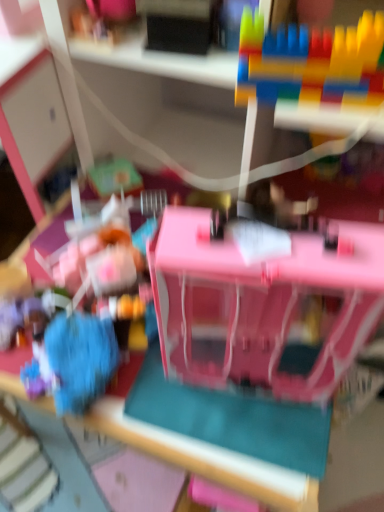
This screenshot has width=384, height=512. What do you see at coordinates (261, 301) in the screenshot?
I see `pink plastic dollhouse at center, arranged as the second toy when viewed from the left` at bounding box center [261, 301].

What is the approximate width of blue fuzzy ball at lower left, which is the first toy in bottom-to-top order?

It is 13.19 centimeters.

What do you see at coordinates (80, 359) in the screenshot? The image size is (384, 512). I see `blue fuzzy ball at lower left, the 3th toy from the right` at bounding box center [80, 359].

Image resolution: width=384 pixels, height=512 pixels. What are the coordinates of `multicolored plastic blocks at upper right, acting as the 1th toy starting from the top` in the screenshot? It's located at (311, 62).

Where is `pink plastic dollhouse at center, the second toy viewed from the right`? The image size is (384, 512). pink plastic dollhouse at center, the second toy viewed from the right is located at coordinates (261, 301).

From a real-world perspective, is multicolored plastic blocks at upper right, placed as the third toy when sorted from left to right, positioned above or below pink plastic dollhouse at center, arranged as the second toy when viewed from the left?

From a real-world perspective, multicolored plastic blocks at upper right, placed as the third toy when sorted from left to right, is physically above pink plastic dollhouse at center, arranged as the second toy when viewed from the left.

Can you confirm if multicolored plastic blocks at upper right, placed as the 1th toy when sorted from right to left, is bigger than pink plastic dollhouse at center, the second toy viewed from the right?

Actually, multicolored plastic blocks at upper right, placed as the 1th toy when sorted from right to left, might be smaller than pink plastic dollhouse at center, the second toy viewed from the right.

Find the location of a particular element. The image size is (384, 512). toy that is the 1st one below the multicolored plastic blocks at upper right, placed as the third toy when sorted from left to right (from a real-world perspective) is located at coordinates (261, 301).

Would you consider blue fuzzy ball at lower left, the 3th toy when ordered from top to bottom, to be distant from multicolored plastic blocks at upper right, acting as the 1th toy starting from the top?

No, blue fuzzy ball at lower left, the 3th toy when ordered from top to bottom, is not far away from multicolored plastic blocks at upper right, acting as the 1th toy starting from the top.

Considering their positions, is blue fuzzy ball at lower left, which is the first toy in bottom-to-top order, located in front of or behind multicolored plastic blocks at upper right, which is counted as the 3th toy, starting from the bottom?

In the image, blue fuzzy ball at lower left, which is the first toy in bottom-to-top order, appears behind multicolored plastic blocks at upper right, which is counted as the 3th toy, starting from the bottom.

Consider the image. From the image's perspective, between blue fuzzy ball at lower left, which is the 1th toy from left to right, and multicolored plastic blocks at upper right, acting as the 1th toy starting from the top, which one is located above?

multicolored plastic blocks at upper right, acting as the 1th toy starting from the top, is shown above in the image.

How much distance is there between multicolored plastic blocks at upper right, placed as the third toy when sorted from left to right, and blue fuzzy ball at lower left, which is the first toy in bottom-to-top order?

They are 18.88 inches apart.

Between multicolored plastic blocks at upper right, which is counted as the 3th toy, starting from the bottom, and blue fuzzy ball at lower left, the 3th toy when ordered from top to bottom, which one appears on the right side from the viewer's perspective?

From the viewer's perspective, multicolored plastic blocks at upper right, which is counted as the 3th toy, starting from the bottom, appears more on the right side.

Considering the positions of point (312, 81) and point (61, 340), is point (312, 81) closer or farther from the camera than point (61, 340)?

Point (312, 81) is closer to the camera than point (61, 340).

Locate an element on the screen. The width and height of the screenshot is (384, 512). toy lying behind the multicolored plastic blocks at upper right, placed as the 1th toy when sorted from right to left is located at coordinates (80, 359).

Is point (98, 372) in front of point (233, 254)?

No, (98, 372) is further to viewer.

From the image's perspective, which one is positioned lower, blue fuzzy ball at lower left, which is the first toy in bottom-to-top order, or pink plastic dollhouse at center, the second toy in the bottom-to-top sequence?

blue fuzzy ball at lower left, which is the first toy in bottom-to-top order, from the image's perspective.

Is blue fuzzy ball at lower left, which is the first toy in bottom-to-top order, facing towards pink plastic dollhouse at center, the second toy in the bottom-to-top sequence?

No, blue fuzzy ball at lower left, which is the first toy in bottom-to-top order, is not facing towards pink plastic dollhouse at center, the second toy in the bottom-to-top sequence.

Does blue fuzzy ball at lower left, the 3th toy when ordered from top to bottom, have a greater height compared to pink plastic dollhouse at center, the second toy in the bottom-to-top sequence?

No, blue fuzzy ball at lower left, the 3th toy when ordered from top to bottom, is not taller than pink plastic dollhouse at center, the second toy in the bottom-to-top sequence.

Does pink plastic dollhouse at center, the second toy in the bottom-to-top sequence, appear on the left side of blue fuzzy ball at lower left, the 3th toy when ordered from top to bottom?

No.

Can you tell me how much pink plastic dollhouse at center, the second toy in the bottom-to-top sequence, and blue fuzzy ball at lower left, which is the 1th toy from left to right, differ in facing direction?

The angle between the facing direction of pink plastic dollhouse at center, the second toy in the bottom-to-top sequence, and the facing direction of blue fuzzy ball at lower left, which is the 1th toy from left to right, is 15.1 degrees.

Which is correct: pink plastic dollhouse at center, arranged as the second toy when viewed from the left, is inside blue fuzzy ball at lower left, the 3th toy from the right, or outside of it?

pink plastic dollhouse at center, arranged as the second toy when viewed from the left, lies outside blue fuzzy ball at lower left, the 3th toy from the right.

Would you consider pink plastic dollhouse at center, the 2th toy when ordered from top to bottom, to be distant from blue fuzzy ball at lower left, which is the 1th toy from left to right?

No, pink plastic dollhouse at center, the 2th toy when ordered from top to bottom, is not far away from blue fuzzy ball at lower left, which is the 1th toy from left to right.

From a real-world perspective, which is physically below, pink plastic dollhouse at center, arranged as the second toy when viewed from the left, or multicolored plastic blocks at upper right, placed as the third toy when sorted from left to right?

pink plastic dollhouse at center, arranged as the second toy when viewed from the left.

Considering the sizes of pink plastic dollhouse at center, the 2th toy when ordered from top to bottom, and multicolored plastic blocks at upper right, placed as the 1th toy when sorted from right to left, in the image, is pink plastic dollhouse at center, the 2th toy when ordered from top to bottom, taller or shorter than multicolored plastic blocks at upper right, placed as the 1th toy when sorted from right to left,?

Considering their sizes, pink plastic dollhouse at center, the 2th toy when ordered from top to bottom, has more height than multicolored plastic blocks at upper right, placed as the 1th toy when sorted from right to left.

Could you tell me if pink plastic dollhouse at center, the second toy viewed from the right, is turned towards multicolored plastic blocks at upper right, acting as the 1th toy starting from the top?

No, pink plastic dollhouse at center, the second toy viewed from the right, is not facing towards multicolored plastic blocks at upper right, acting as the 1th toy starting from the top.

Is point (177, 271) more distant than point (258, 23)?

No, it is in front of (258, 23).

Identify the location of toy located above the pink plastic dollhouse at center, the second toy viewed from the right (from the image's perspective). The height and width of the screenshot is (512, 384). (311, 62).

Find the location of a particular element. The width and height of the screenshot is (384, 512). toy that is the 2nd object above the blue fuzzy ball at lower left, which is the first toy in bottom-to-top order (from a real-world perspective) is located at coordinates (311, 62).

Consider the image. Estimate the real-world distances between objects in this image. Which object is closer to pink plastic dollhouse at center, the second toy viewed from the right, multicolored plastic blocks at upper right, placed as the 1th toy when sorted from right to left, or blue fuzzy ball at lower left, which is the 1th toy from left to right?

The object closer to pink plastic dollhouse at center, the second toy viewed from the right, is blue fuzzy ball at lower left, which is the 1th toy from left to right.

Looking at this image, from the image, which object appears to be farther from multicolored plastic blocks at upper right, placed as the 1th toy when sorted from right to left, pink plastic dollhouse at center, arranged as the second toy when viewed from the left, or blue fuzzy ball at lower left, which is the 1th toy from left to right?

Among the two, blue fuzzy ball at lower left, which is the 1th toy from left to right, is located further to multicolored plastic blocks at upper right, placed as the 1th toy when sorted from right to left.

Looking at the image, which one is located closer to pink plastic dollhouse at center, the second toy in the bottom-to-top sequence, blue fuzzy ball at lower left, which is the first toy in bottom-to-top order, or multicolored plastic blocks at upper right, placed as the third toy when sorted from left to right?

blue fuzzy ball at lower left, which is the first toy in bottom-to-top order, lies closer to pink plastic dollhouse at center, the second toy in the bottom-to-top sequence, than the other object.

From the image, which object appears to be farther from blue fuzzy ball at lower left, which is the 1th toy from left to right, pink plastic dollhouse at center, the second toy in the bottom-to-top sequence, or multicolored plastic blocks at upper right, placed as the third toy when sorted from left to right?

Based on the image, multicolored plastic blocks at upper right, placed as the third toy when sorted from left to right, appears to be further to blue fuzzy ball at lower left, which is the 1th toy from left to right.

Which object lies nearer to the anchor point blue fuzzy ball at lower left, which is the 1th toy from left to right, multicolored plastic blocks at upper right, placed as the third toy when sorted from left to right, or pink plastic dollhouse at center, arranged as the second toy when viewed from the left?

pink plastic dollhouse at center, arranged as the second toy when viewed from the left, is positioned closer to the anchor blue fuzzy ball at lower left, which is the 1th toy from left to right.

From the image, which object appears to be nearer to multicolored plastic blocks at upper right, placed as the 1th toy when sorted from right to left, blue fuzzy ball at lower left, which is the first toy in bottom-to-top order, or pink plastic dollhouse at center, the second toy in the bottom-to-top sequence?

pink plastic dollhouse at center, the second toy in the bottom-to-top sequence, is closer to multicolored plastic blocks at upper right, placed as the 1th toy when sorted from right to left.

Locate an element on the screen. The width and height of the screenshot is (384, 512). toy between multicolored plastic blocks at upper right, placed as the third toy when sorted from left to right, and blue fuzzy ball at lower left, the 3th toy from the right, vertically is located at coordinates (261, 301).